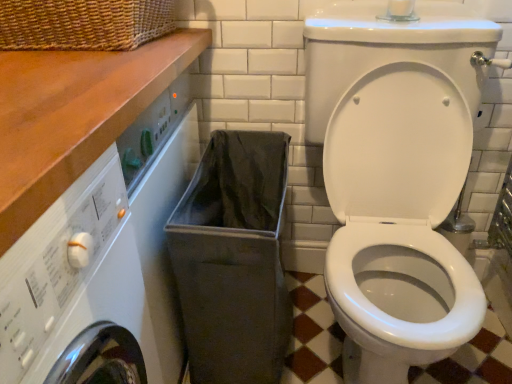
The height and width of the screenshot is (384, 512). Find the location of `gray fabric laundry basket at lower center`. gray fabric laundry basket at lower center is located at coordinates (233, 260).

Where is `white glossy toilet at center`? white glossy toilet at center is located at coordinates (398, 222).

The height and width of the screenshot is (384, 512). I want to click on laundry basket that appears behind the wooden at upper left, so click(233, 260).

Considering the relative sizes of wooden at upper left and gray fabric laundry basket at lower center in the image provided, is wooden at upper left smaller than gray fabric laundry basket at lower center?

Yes, wooden at upper left is smaller than gray fabric laundry basket at lower center.

Considering the positions of points (136, 64) and (194, 332), is point (136, 64) farther from camera compared to point (194, 332)?

No, it is in front of (194, 332).

Is wooden at upper left positioned with its back to gray fabric laundry basket at lower center?

No.

Is white glossy toilet at center positioned in front of wooden at upper left?

No, white glossy toilet at center is behind wooden at upper left.

Which is correct: white glossy toilet at center is inside wooden at upper left, or outside of it?

white glossy toilet at center is spatially situated outside wooden at upper left.

Considering the relative positions of white glossy toilet at center and wooden at upper left in the image provided, is white glossy toilet at center to the left of wooden at upper left from the viewer's perspective?

No.

From the picture: Who is shorter, white glossy toilet at center or wooden at upper left?

Standing shorter between the two is wooden at upper left.

From the image's perspective, is gray fabric laundry basket at lower center on top of white glossy toilet at center?

Actually, gray fabric laundry basket at lower center appears below white glossy toilet at center in the image.

Is gray fabric laundry basket at lower center turned away from white glossy toilet at center?

gray fabric laundry basket at lower center is not turned away from white glossy toilet at center.

Image resolution: width=512 pixels, height=384 pixels. Find the location of `toilet located above the gray fabric laundry basket at lower center (from the image's perspective)`. toilet located above the gray fabric laundry basket at lower center (from the image's perspective) is located at coordinates (398, 222).

In terms of height, does gray fabric laundry basket at lower center look taller or shorter compared to white glossy toilet at center?

Clearly, gray fabric laundry basket at lower center is shorter compared to white glossy toilet at center.

In the scene shown: Who is shorter, wooden at upper left or white glossy toilet at center?

wooden at upper left is shorter.

The height and width of the screenshot is (384, 512). In order to click on counter top above the white glossy toilet at center (from a real-world perspective) in this screenshot , I will do `click(73, 115)`.

From a real-world perspective, which is physically below, wooden at upper left or white glossy toilet at center?

white glossy toilet at center is physically lower.

Considering the points (84, 110) and (338, 150), which point is in front, point (84, 110) or point (338, 150)?

The point (84, 110) is in front.

Find the location of a particular element. Image resolution: width=512 pixels, height=384 pixels. laundry basket that is below the white glossy toilet at center (from the image's perspective) is located at coordinates (233, 260).

Is white glossy toilet at center not within gray fabric laundry basket at lower center?

Yes.

Is white glossy toilet at center with gray fabric laundry basket at lower center?

white glossy toilet at center and gray fabric laundry basket at lower center are not in contact.

Considering the positions of point (437, 173) and point (270, 173), is point (437, 173) closer or farther from the camera than point (270, 173)?

Point (437, 173) is closer to the camera than point (270, 173).

Measure the distance between gray fabric laundry basket at lower center and wooden at upper left.

17.11 inches.

Is gray fabric laundry basket at lower center positioned behind wooden at upper left?

Yes, it is.

From a real-world perspective, relative to wooden at upper left, is gray fabric laundry basket at lower center vertically above or below?

From a real-world perspective, gray fabric laundry basket at lower center is physically below wooden at upper left.

Is gray fabric laundry basket at lower center located outside wooden at upper left?

That's correct, gray fabric laundry basket at lower center is outside of wooden at upper left.

The height and width of the screenshot is (384, 512). In order to click on counter top that is in front of the gray fabric laundry basket at lower center in this screenshot , I will do `click(73, 115)`.

Where is `counter top above the white glossy toilet at center (from the image's perspective)`? The height and width of the screenshot is (384, 512). counter top above the white glossy toilet at center (from the image's perspective) is located at coordinates (73, 115).

Looking at this image, considering their positions, is white glossy toilet at center positioned closer to gray fabric laundry basket at lower center than wooden at upper left?

Based on the image, white glossy toilet at center appears to be nearer to gray fabric laundry basket at lower center.

When comparing their distances from white glossy toilet at center, does gray fabric laundry basket at lower center or wooden at upper left seem further?

wooden at upper left.

From the image, which object appears to be farther from white glossy toilet at center, wooden at upper left or gray fabric laundry basket at lower center?

Among the two, wooden at upper left is located further to white glossy toilet at center.

Which object lies nearer to the anchor point wooden at upper left, gray fabric laundry basket at lower center or white glossy toilet at center?

The object closer to wooden at upper left is gray fabric laundry basket at lower center.

Looking at this image, considering their positions, is white glossy toilet at center positioned closer to wooden at upper left than gray fabric laundry basket at lower center?

gray fabric laundry basket at lower center is positioned closer to the anchor wooden at upper left.

Based on their spatial positions, is wooden at upper left or white glossy toilet at center closer to gray fabric laundry basket at lower center?

Among the two, white glossy toilet at center is located nearer to gray fabric laundry basket at lower center.

You are a GUI agent. You are given a task and a screenshot of the screen. Output one action in this format:
    pyautogui.click(x=<x>, y=<y>)
    Task: Click on the laundry basket located between wooden at upper left and white glossy toilet at center in the left-right direction
    This screenshot has width=512, height=384.
    Given the screenshot: What is the action you would take?
    pyautogui.click(x=233, y=260)